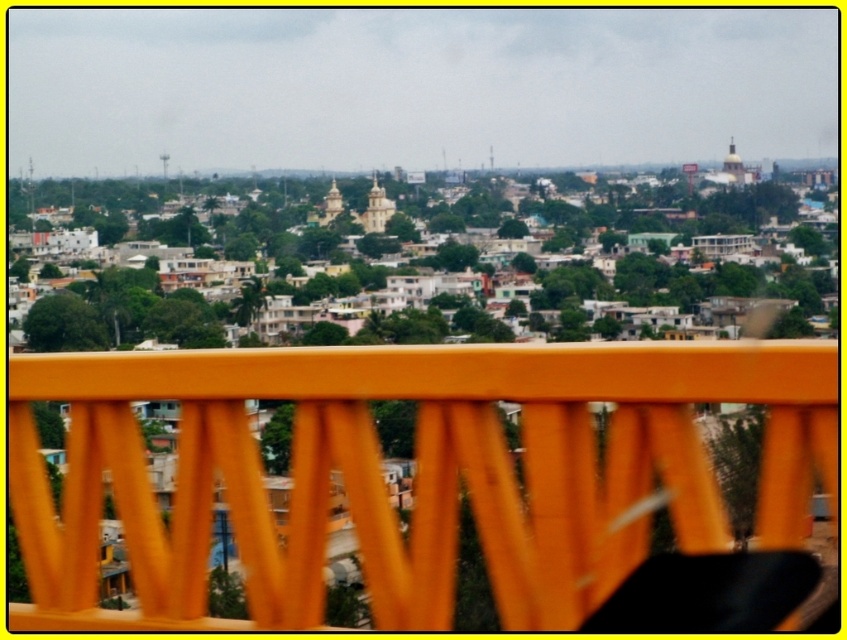
Is orange matte rail at center positioned at the back of matte gold dome at upper center?

No, it is in front of matte gold dome at upper center.

This screenshot has width=847, height=640. What do you see at coordinates (414, 472) in the screenshot?
I see `orange matte rail at center` at bounding box center [414, 472].

Measure the distance between point (133, 499) and camera.

Point (133, 499) is 2125.60 feet from camera.

This screenshot has width=847, height=640. I want to click on orange matte rail at center, so click(414, 472).